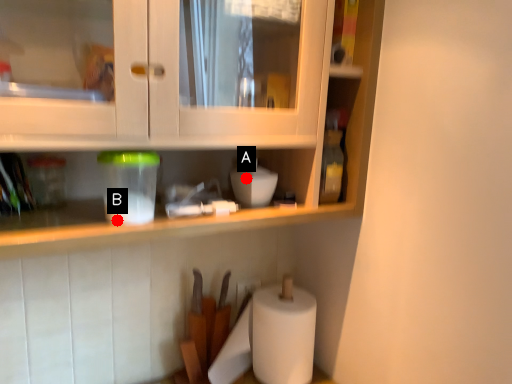
Question: Two points are circled on the image, labeled by A and B beside each circle. Which point is closer to the camera taking this photo?

Choices:
 (A) A is closer
 (B) B is closer

Answer: (B)